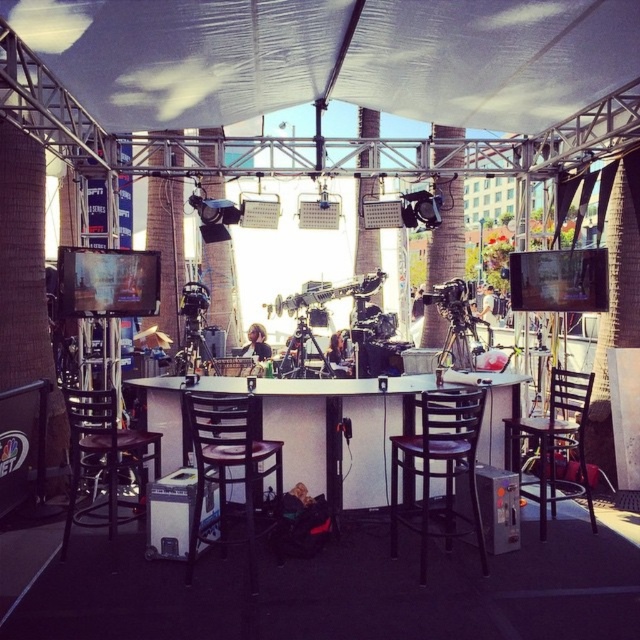
You are a technician setting up equipment for a live broadcast. You need to position a new monitor between the white laminate table at center and the matte black tripod at center. Based on their positions, which object should the monitor be placed closer to?

The white laminate table at center is in front of the matte black tripod at center, so the monitor should be placed closer to the white laminate table at center to maintain alignment with the front setup.

You are a technician setting up for a live broadcast. You need to position a new camera between the white laminate table at center and the brown wooden chair at center. Which object should the camera be placed in front of to ensure it faces the correct direction for the broadcast?

The camera should be placed in front of the white laminate table at center because the brown wooden chair at center is behind it, ensuring the camera faces the table where the participants will be seated.